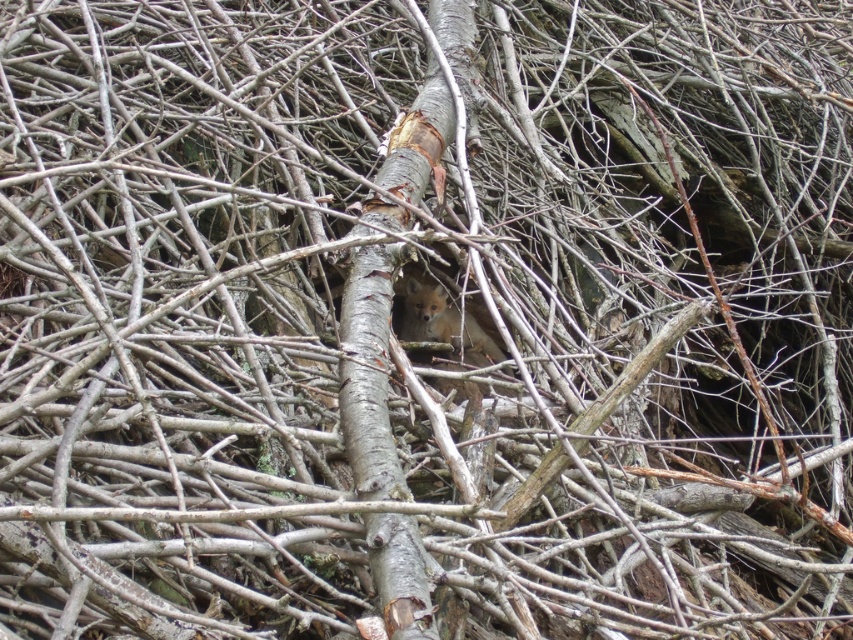
Does gray bark tree trunk at center appear over fluffy reddish-brown fox at center?

Correct, gray bark tree trunk at center is located above fluffy reddish-brown fox at center.

Based on the photo, between gray bark tree trunk at center and fluffy reddish-brown fox at center, which one appears on the right side from the viewer's perspective?

fluffy reddish-brown fox at center

Does point (380, 596) come behind point (444, 332)?

That is False.

Image resolution: width=853 pixels, height=640 pixels. I want to click on gray bark tree trunk at center, so click(x=369, y=371).